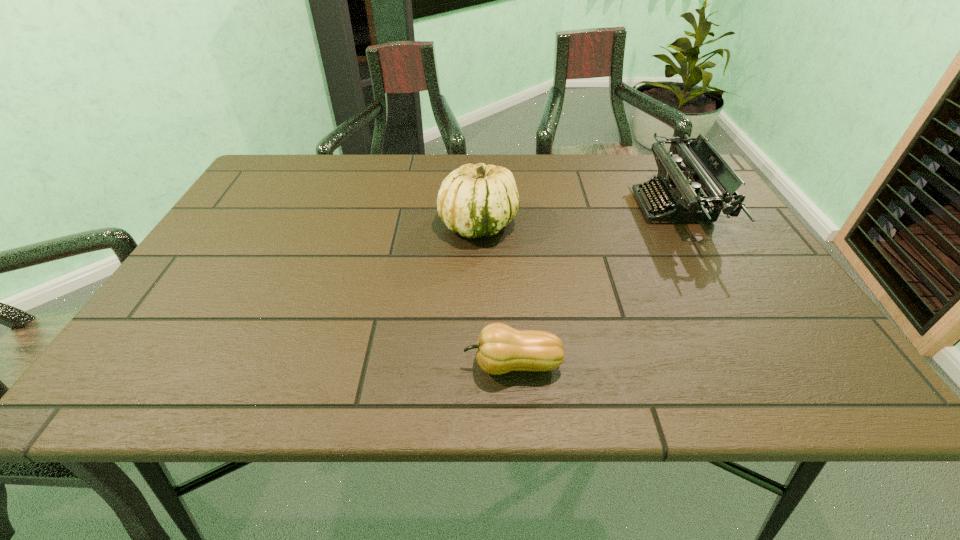
At what (x,y) coordinates should I click in order to perform the action: click on the taller gourd. Please return your answer as a coordinate pair (x, y). The image size is (960, 540). Looking at the image, I should click on (478, 200).

You are a GUI agent. You are given a task and a screenshot of the screen. Output one action in this format:
    pyautogui.click(x=<x>, y=<y>)
    Task: Click on the typewriter
    The height and width of the screenshot is (540, 960).
    Given the screenshot: What is the action you would take?
    pyautogui.click(x=705, y=168)

Identify the location of the shorter gourd. (500, 349).

This screenshot has height=540, width=960. I want to click on the nearest object, so click(500, 349).

Where is `vacant space situated on the right of the taller gourd`? The image size is (960, 540). vacant space situated on the right of the taller gourd is located at coordinates (648, 224).

You are a GUI agent. You are given a task and a screenshot of the screen. Output one action in this format:
    pyautogui.click(x=<x>, y=<y>)
    Task: Click on the free location located on the typing side of the typewriter
    Image resolution: width=960 pixels, height=540 pixels.
    Given the screenshot: What is the action you would take?
    566,207

Image resolution: width=960 pixels, height=540 pixels. Find the location of `blank space located 0.090m on the typing side of the typewriter`. blank space located 0.090m on the typing side of the typewriter is located at coordinates pyautogui.click(x=604, y=207).

At what (x,y) coordinates should I click in order to perform the action: click on vacant space located on the typing side of the typewriter. Please return your answer as a coordinate pair (x, y). Looking at the image, I should click on (589, 207).

Find the location of `vacant space located 0.230m on the stem side of the nearer gourd`. vacant space located 0.230m on the stem side of the nearer gourd is located at coordinates (339, 364).

What are the coordinates of `free space located on the stem side of the nearer gourd` in the screenshot? It's located at (246, 364).